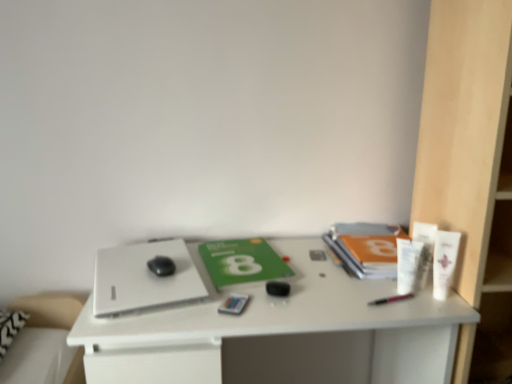
Locate an element on the screen. vacant position to the left of white plastic tube at right, the third toiletry positioned from the right is located at coordinates (340, 291).